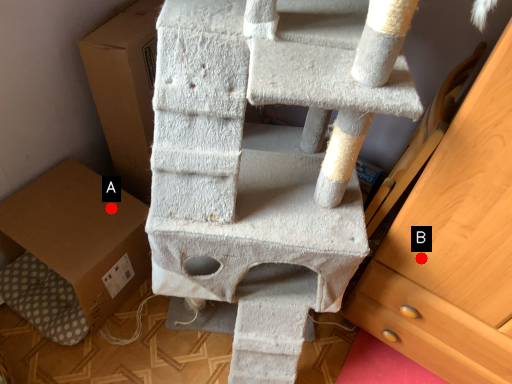
Question: Two points are circled on the image, labeled by A and B beside each circle. Which point is closer to the camera taking this photo?

Choices:
 (A) A is closer
 (B) B is closer

Answer: (B)